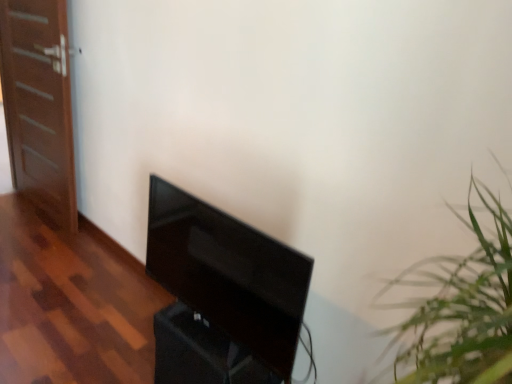
Question: From the image's perspective, is black glossy tv at center located above or below brown wooden door at left?

Choices:
 (A) above
 (B) below

Answer: (B)

Question: In terms of width, does black glossy tv at center look wider or thinner when compared to brown wooden door at left?

Choices:
 (A) thin
 (B) wide

Answer: (B)

Question: From a real-world perspective, is black glossy tv at center physically located above or below brown wooden door at left?

Choices:
 (A) above
 (B) below

Answer: (B)

Question: Considering the positions of brown wooden door at left and black glossy tv at center in the image, is brown wooden door at left taller or shorter than black glossy tv at center?

Choices:
 (A) short
 (B) tall

Answer: (B)

Question: Is point (22, 24) closer or farther from the camera than point (249, 233)?

Choices:
 (A) farther
 (B) closer

Answer: (A)

Question: From a real-world perspective, is brown wooden door at left physically located above or below black glossy tv at center?

Choices:
 (A) above
 (B) below

Answer: (A)

Question: Considering the positions of brown wooden door at left and black glossy tv at center in the image, is brown wooden door at left wider or thinner than black glossy tv at center?

Choices:
 (A) thin
 (B) wide

Answer: (A)